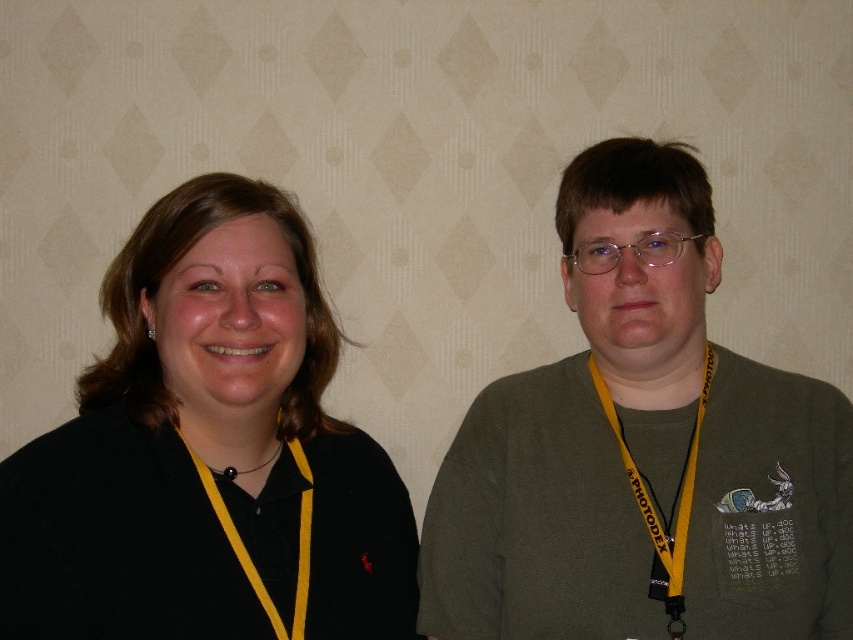
Who is taller, matte green sweater at right or yellow fabric lanyard at right?

matte green sweater at right is taller.

Does point (837, 444) come farther from viewer compared to point (671, 624)?

Yes, it is.

In order to click on matte green sweater at right in this screenshot , I will do `click(641, 451)`.

This screenshot has width=853, height=640. What do you see at coordinates (202, 460) in the screenshot?
I see `black matte shirt at left` at bounding box center [202, 460].

This screenshot has height=640, width=853. I want to click on black matte shirt at left, so click(x=202, y=460).

Locate an element on the screen. black matte shirt at left is located at coordinates (202, 460).

Can you confirm if matte green sweater at right is shorter than black matte shirt at left?

Incorrect, matte green sweater at right's height does not fall short of black matte shirt at left's.

Is matte green sweater at right closer to camera compared to black matte shirt at left?

No, matte green sweater at right is behind black matte shirt at left.

Where is `matte green sweater at right`? matte green sweater at right is located at coordinates (641, 451).